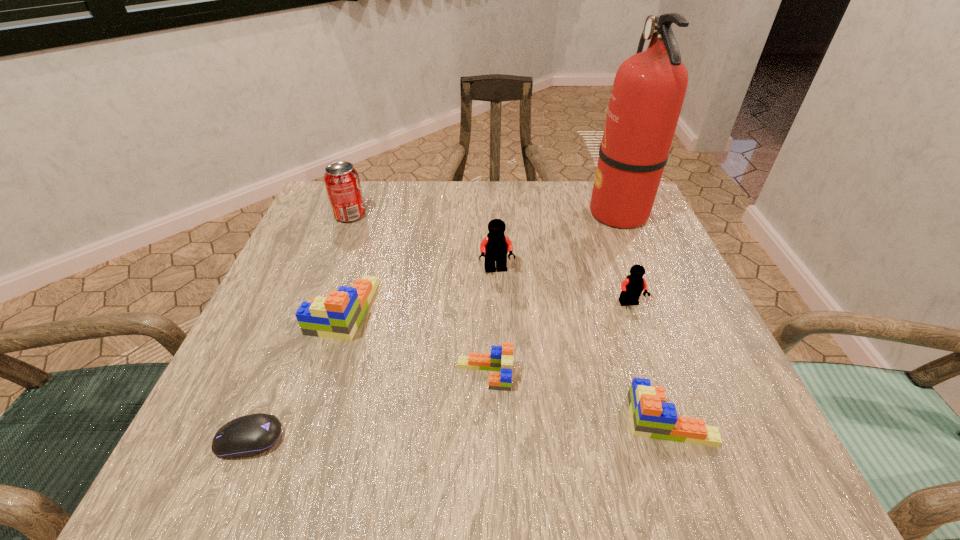
You are a GUI agent. You are given a task and a screenshot of the screen. Output one action in this format:
    pyautogui.click(x=<x>, y=<y>)
    Task: Click on the second shortest Lego
    This screenshot has width=960, height=540.
    Given the screenshot: What is the action you would take?
    pyautogui.click(x=651, y=417)

This screenshot has height=540, width=960. In order to click on the second shortest object in this screenshot , I will do `click(501, 358)`.

In order to click on the second orange Lego from left to right in this screenshot , I will do click(501, 358).

This screenshot has width=960, height=540. I want to click on the shortest object, so click(x=246, y=436).

Locate an element on the screen. computer mouse is located at coordinates (246, 436).

This screenshot has height=540, width=960. I want to click on free location located on the side of the tallest object with the nozzle and handle, so click(469, 212).

I want to click on vacant space situated 0.280m on the side of the tallest object with the nozzle and handle, so click(x=473, y=212).

Locate an element on the screen. The image size is (960, 540). vacant space situated on the side of the tallest object with the nozzle and handle is located at coordinates (531, 212).

I want to click on free location located on the right of the soda can, so click(x=432, y=215).

Image resolution: width=960 pixels, height=540 pixels. I want to click on free location located on the front-facing side of the farthest Lego, so click(499, 330).